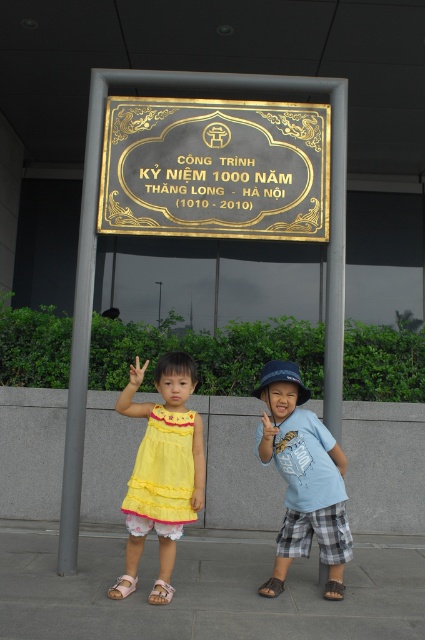
What is the exact coordinate of the yellow cotton dress at center?

The yellow cotton dress at center is located at point (161, 468).

You are a photographer taking a picture of the commemorative plaque. You notice the yellow cotton dress at center and the blue cotton shirt at center in the frame. Which clothing item should you adjust to ensure both are fully visible in the photo?

The yellow cotton dress at center is larger in size than the blue cotton shirt at center, so you should adjust the blue cotton shirt at center to ensure both are fully visible in the photo.